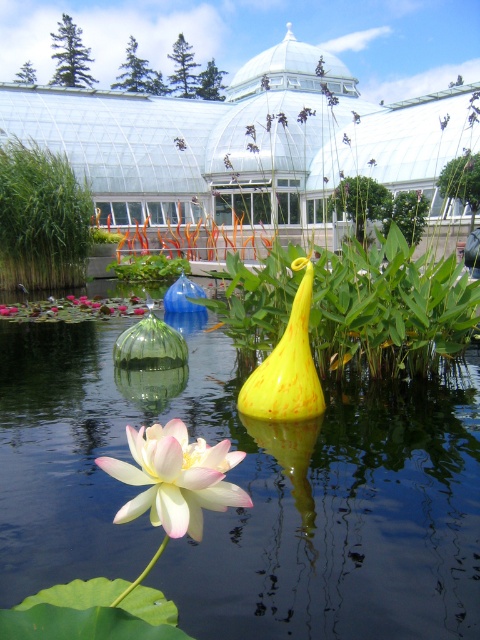
Which is more to the left, transparent glass water at center or yellow matte vase at center?

From the viewer's perspective, transparent glass water at center appears more on the left side.

How much distance is there between transparent glass water at center and yellow matte vase at center?

17.65 inches

Is point (400, 522) positioned before point (308, 323)?

Yes, point (400, 522) is closer to viewer.

At what (x,y) coordinates should I click in order to perform the action: click on transparent glass water at center. Please return your answer as a coordinate pair (x, y). The width and height of the screenshot is (480, 640). Looking at the image, I should click on (249, 493).

Between transparent glass water at center and soft pink petal at center, which one has more height?

With more height is soft pink petal at center.

Image resolution: width=480 pixels, height=640 pixels. Describe the element at coordinates (249, 493) in the screenshot. I see `transparent glass water at center` at that location.

At what (x,y) coordinates should I click in order to perform the action: click on transparent glass water at center. Please return your answer as a coordinate pair (x, y). The image size is (480, 640). Looking at the image, I should click on (x=249, y=493).

Is point (244, 552) more distant than point (48, 288)?

No, it is not.

Is the position of transparent glass water at center more distant than that of green grass at left?

That is False.

In order to click on transparent glass water at center in this screenshot , I will do coord(249,493).